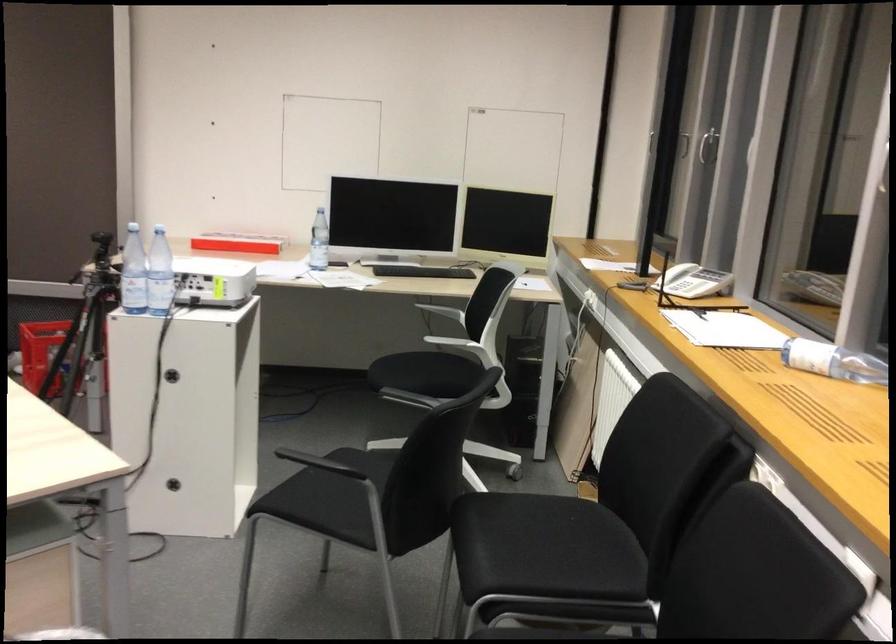
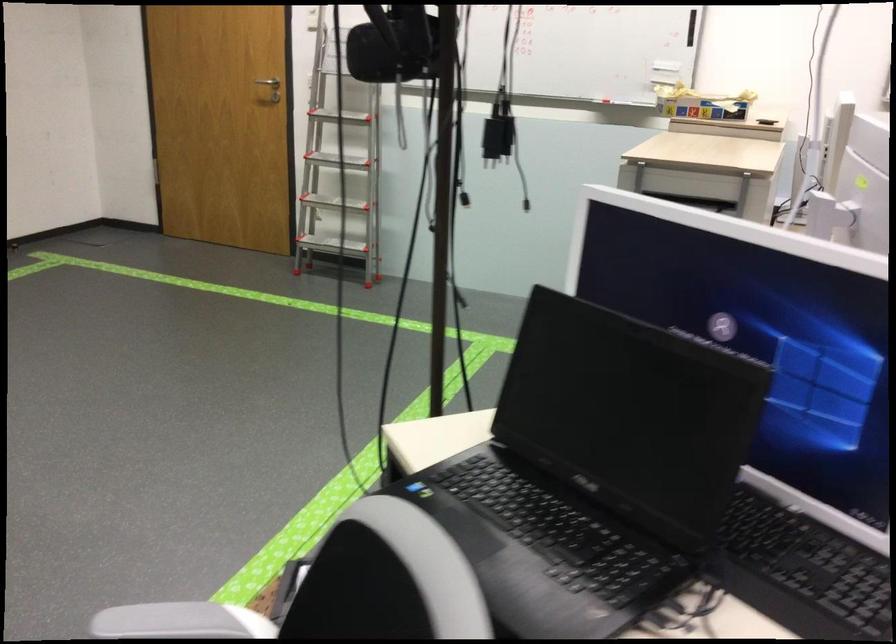
Based on the continuous images, in which direction is the camera rotating?

The camera's rotation is toward left-down.